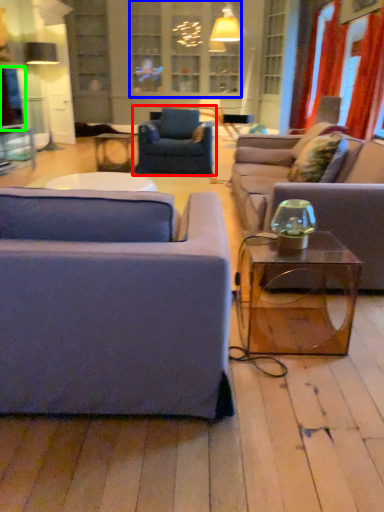
Question: Which object is positioned farthest from chair (highlighted by a red box)? Select from window (highlighted by a blue box) and window screen (highlighted by a green box).

Choices:
 (A) window
 (B) window screen

Answer: (B)